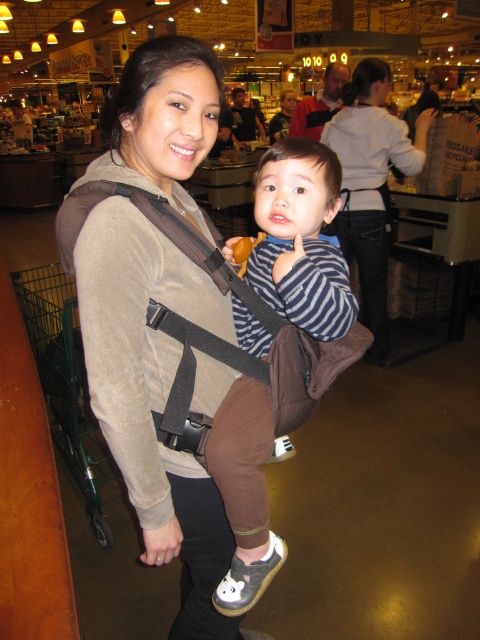
Question: Is brown fabric baby carrier at center smaller than white hoodie at center?

Choices:
 (A) yes
 (B) no

Answer: (A)

Question: Which of the following is the farthest from the observer?

Choices:
 (A) white hoodie at center
 (B) striped fabric shirt at center

Answer: (A)

Question: Among these points, which one is nearest to the camera?

Choices:
 (A) (326, 176)
 (B) (364, 131)

Answer: (A)

Question: Is striped fabric shirt at center bigger than white hoodie at center?

Choices:
 (A) yes
 (B) no

Answer: (B)

Question: Which object appears closest to the camera in this image?

Choices:
 (A) white hoodie at center
 (B) brown fabric baby carrier at center

Answer: (B)

Question: Is striped fabric shirt at center bigger than white hoodie at center?

Choices:
 (A) no
 (B) yes

Answer: (A)